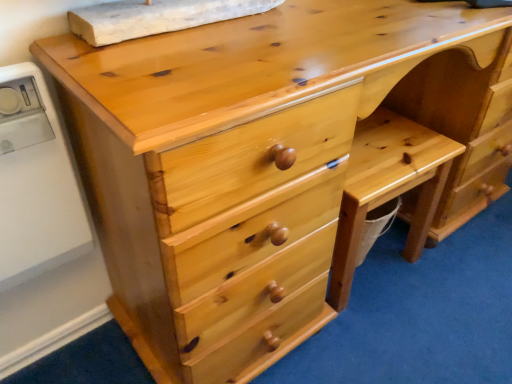
Locate an element on the screen. Image resolution: width=512 pixels, height=384 pixels. vacant region in front of natural wood chair at lower right is located at coordinates (394, 338).